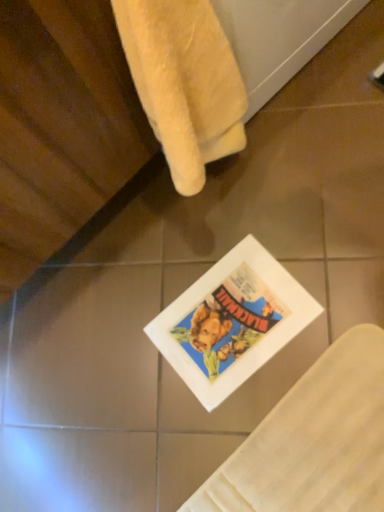
At what (x,y) coordinates should I click in order to perform the action: click on vacant area on top of matte paper comic book at center (from a real-world perspective). Please return your answer as a coordinate pair (x, y). Looking at the image, I should click on (226, 322).